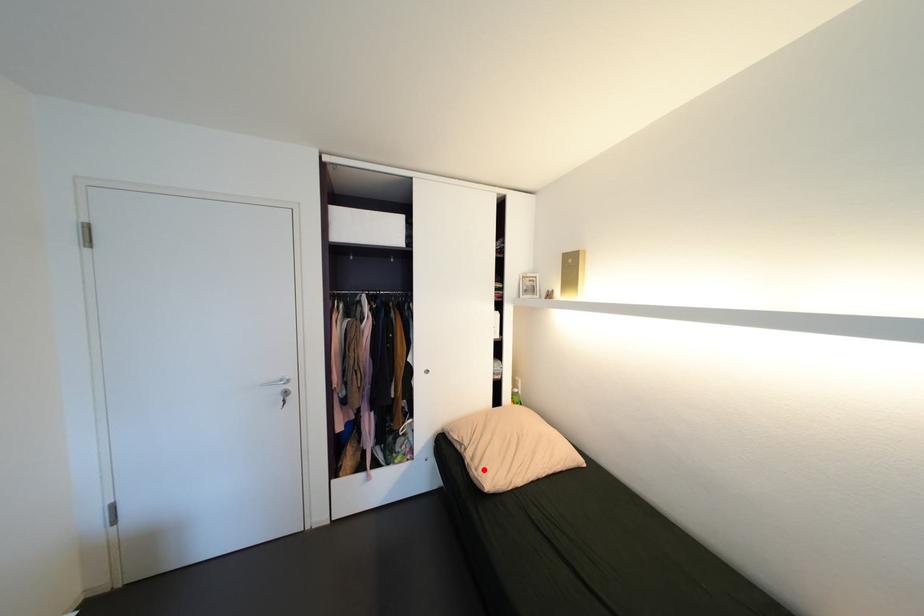
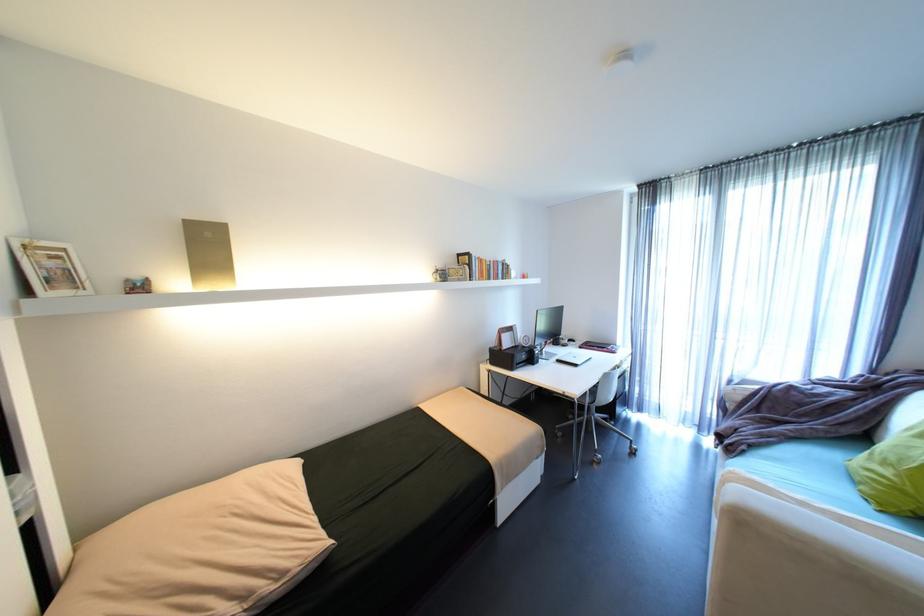
In the second image, find the point that corresponds to the highlighted location in the first image.

(289, 575)